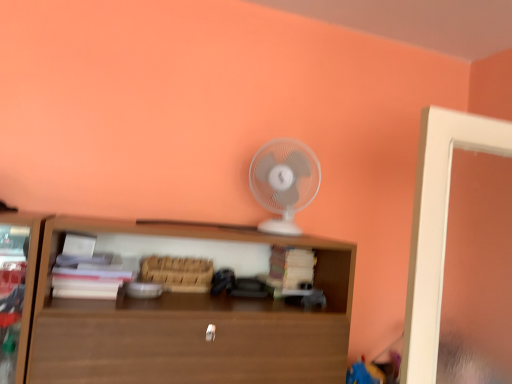
Question: Looking at their shapes, would you say brown wooden shelf at center is wider or thinner than white plastic fan at upper center?

Choices:
 (A) thin
 (B) wide

Answer: (B)

Question: From their relative heights in the image, would you say brown wooden shelf at center is taller or shorter than white plastic fan at upper center?

Choices:
 (A) tall
 (B) short

Answer: (A)

Question: Is brown wooden shelf at center in front of or behind white plastic fan at upper center in the image?

Choices:
 (A) front
 (B) behind

Answer: (A)

Question: From a real-world perspective, is white plastic fan at upper center above or below brown wooden shelf at center?

Choices:
 (A) below
 (B) above

Answer: (B)

Question: Is white plastic fan at upper center situated inside brown wooden shelf at center or outside?

Choices:
 (A) inside
 (B) outside

Answer: (B)

Question: Is white plastic fan at upper center in front of or behind brown wooden shelf at center in the image?

Choices:
 (A) behind
 (B) front

Answer: (A)

Question: In the image, is white plastic fan at upper center on the left side or the right side of brown wooden shelf at center?

Choices:
 (A) right
 (B) left

Answer: (A)